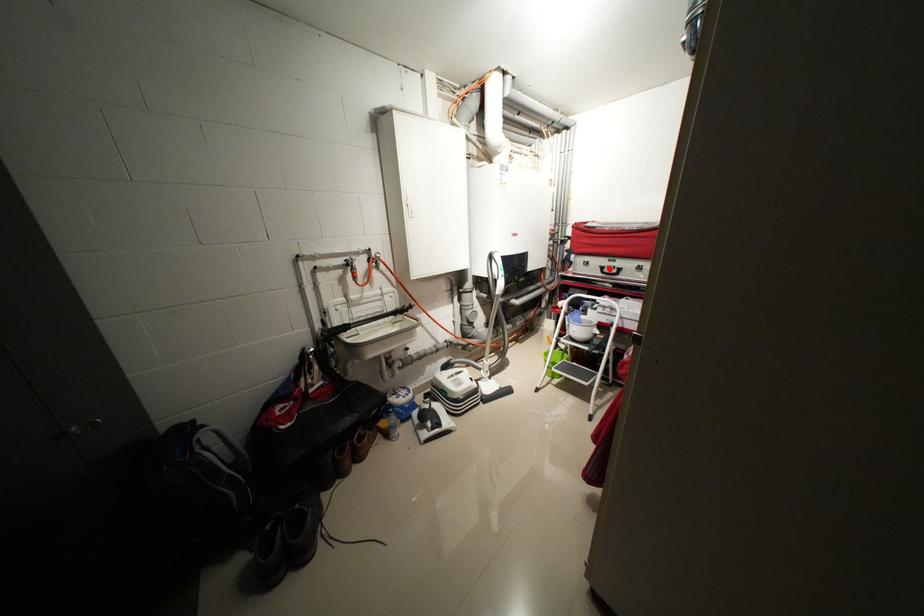
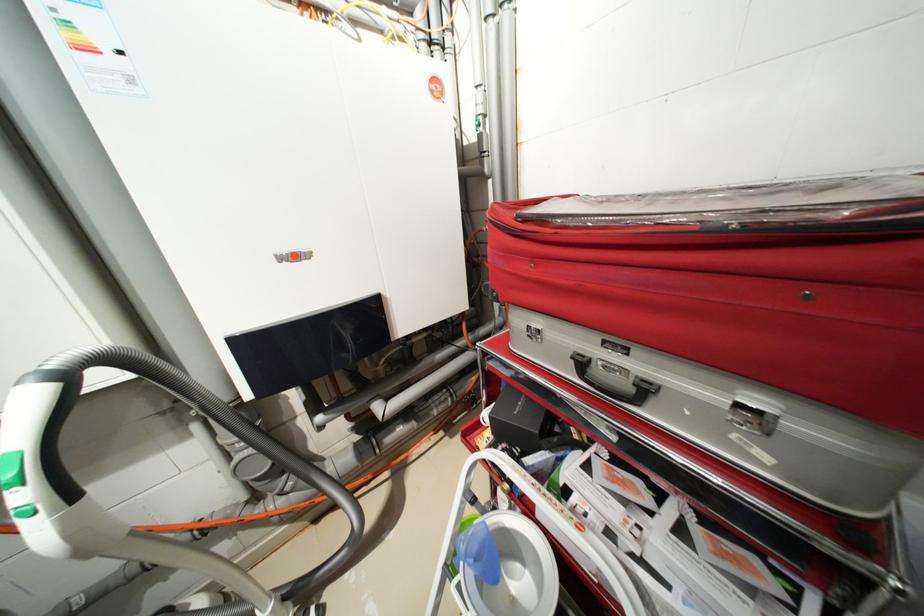
Where in the second image is the point corresponding to the highlighted location from the first image?

(589, 363)